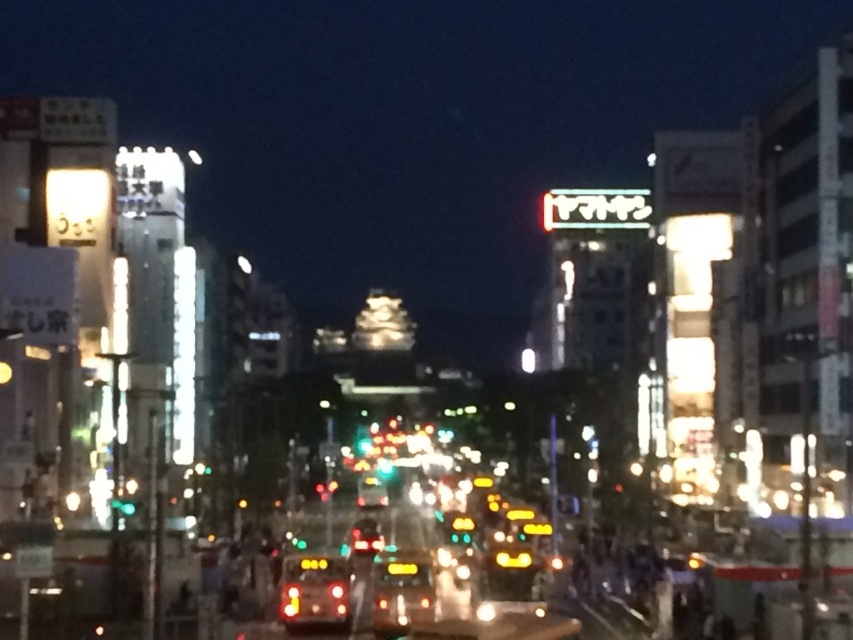
You are a delivery driver who needs to park your car between the two taxis in the scene. Your car is 4.8 meters long. Can you fit your car between the matte yellow taxi at center and the yellow reflective taxi at center?

→ The distance between the matte yellow taxi at center and the yellow reflective taxi at center is 4.93 meters. Since your car is 4.8 meters long, there is enough space to park between them as 4.93 meters is greater than 4.8 meters.

You are a pedestrian trying to cross the street in this busy night scene. You notice two yellow taxis at the center. Which taxi is closer to you, the matte yellow taxi at center or the yellow reflective taxi at center?

The matte yellow taxi at center is closer to you because the yellow reflective taxi at center is positioned behind it.